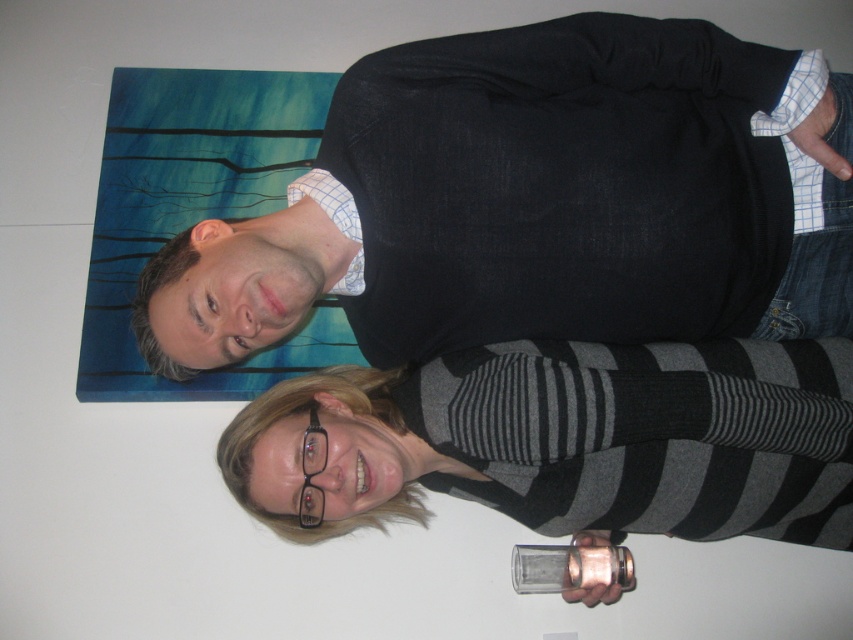
Between black cotton sweater at upper center and clear glass at lower center, which one is positioned higher?

black cotton sweater at upper center is higher up.

Does black cotton sweater at upper center appear over clear glass at lower center?

Yes.

Identify the location of black cotton sweater at upper center. This screenshot has height=640, width=853. (538, 202).

The height and width of the screenshot is (640, 853). Identify the location of black cotton sweater at upper center. (538, 202).